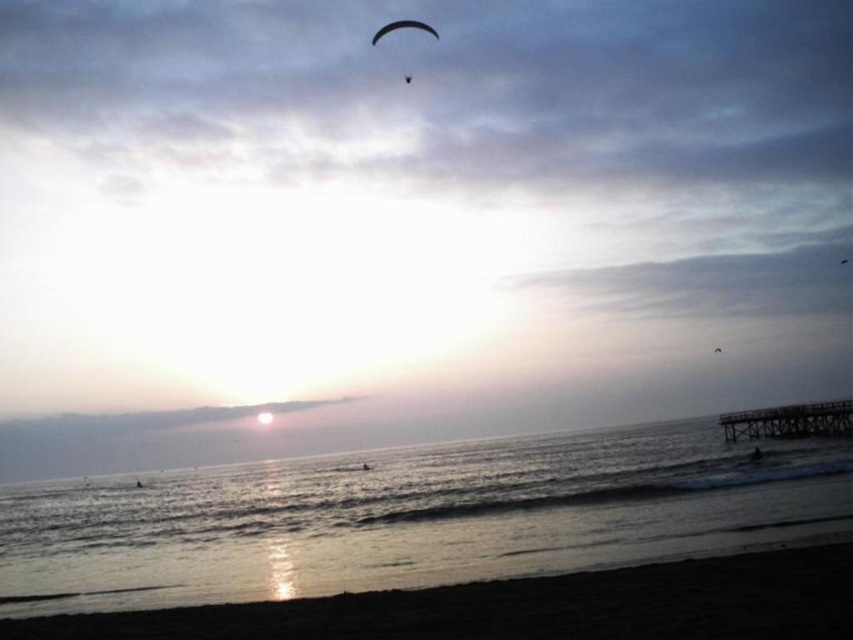
Question: Can you confirm if black matte parachute at upper center is bigger than smooth skin person at lower right?

Choices:
 (A) no
 (B) yes

Answer: (B)

Question: Does glistening water at lower center appear on the right side of smooth skin person at lower right?

Choices:
 (A) yes
 (B) no

Answer: (B)

Question: Is black matte parachute at upper center thinner than smooth skin person at lower right?

Choices:
 (A) no
 (B) yes

Answer: (A)

Question: Which point appears closest to the camera in this image?

Choices:
 (A) (543, 595)
 (B) (759, 449)

Answer: (A)

Question: Which point is closer to the camera taking this photo?

Choices:
 (A) (412, 28)
 (B) (445, 524)

Answer: (B)

Question: Which point is farther to the camera?

Choices:
 (A) (753, 461)
 (B) (836, 566)
 (C) (503, 573)
 (D) (424, 26)

Answer: (D)